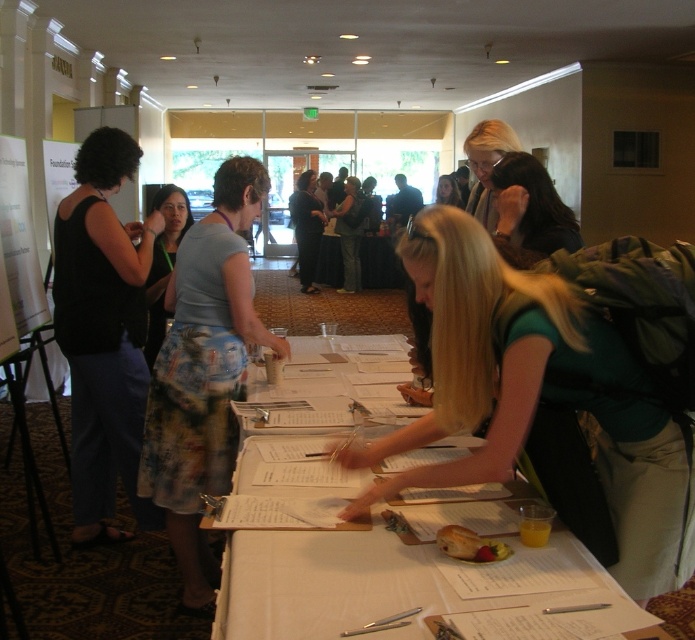
Is golden brown bread at table center shorter than blonde hair at center?

Correct, golden brown bread at table center is not as tall as blonde hair at center.

Which is behind, point (475, 547) or point (457, 189)?

The point (457, 189) is behind.

You are a GUI agent. You are given a task and a screenshot of the screen. Output one action in this format:
    pyautogui.click(x=<x>, y=<y>)
    Task: Click on the golden brown bread at table center
    
    Given the screenshot: What is the action you would take?
    click(468, 545)

Does black fabric tank top at left have a lesser height compared to dark brown hair at upper right?

Incorrect, black fabric tank top at left's height does not fall short of dark brown hair at upper right's.

Between point (98, 340) and point (498, 237), which one is positioned in front?

Point (498, 237)

Between point (97, 476) and point (505, 164), which one is positioned behind?

Point (97, 476)

This screenshot has height=640, width=695. I want to click on black fabric tank top at left, so click(104, 333).

Does matte blue shirt at center appear on the left side of golden brown bread at table center?

Indeed, matte blue shirt at center is positioned on the left side of golden brown bread at table center.

Who is more distant from viewer, (154,308) or (455,531)?

Point (154,308)

Locate an element on the screen. matte blue shirt at center is located at coordinates (163, 260).